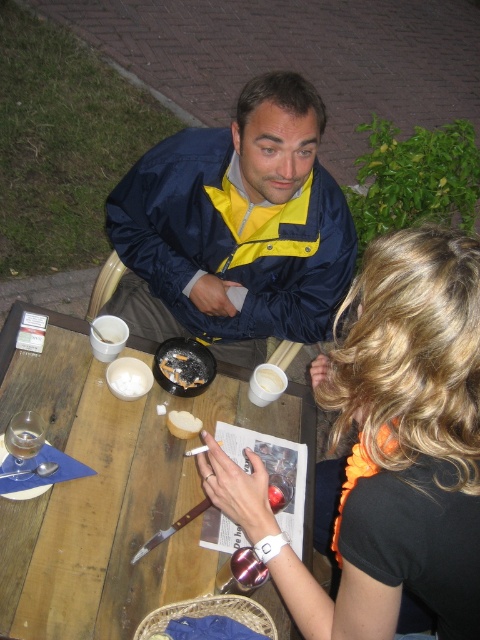
You are a photographer setting up a night scene with two people at a table. You need to place a spotlight so that it illuminates both the black fabric shirt at upper right and the navy blue jacket at upper center. Based on their positions, which object should be placed higher to ensure both are well lit?

The navy blue jacket at upper center should be placed higher since the black fabric shirt at upper right is located below it, ensuring both receive adequate lighting.

You are a waiter at a restaurant and need to deliver a bread basket to the table. The table has a black fabric shirt at upper right and a white matte bread at upper center. Can you place the basket between them without it overlapping either item?

The black fabric shirt at upper right and white matte bread at upper center are 61.42 centimeters apart. Since the basket requires some space, it should fit between them as the distance is sufficient.

What is the object located at the point with coordinates (386, 449) in the image?

The object located at the point with coordinates (386, 449) is the black fabric shirt at upper right.